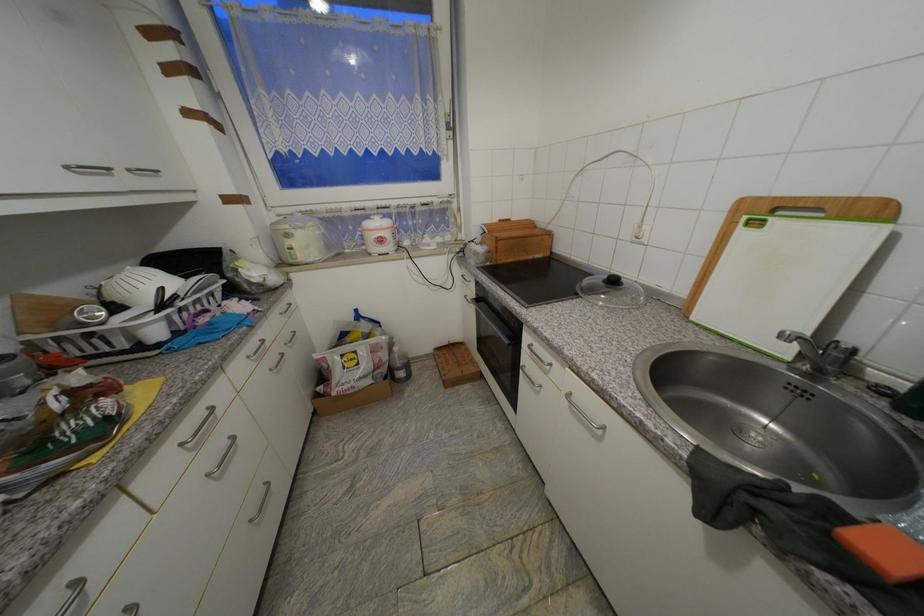
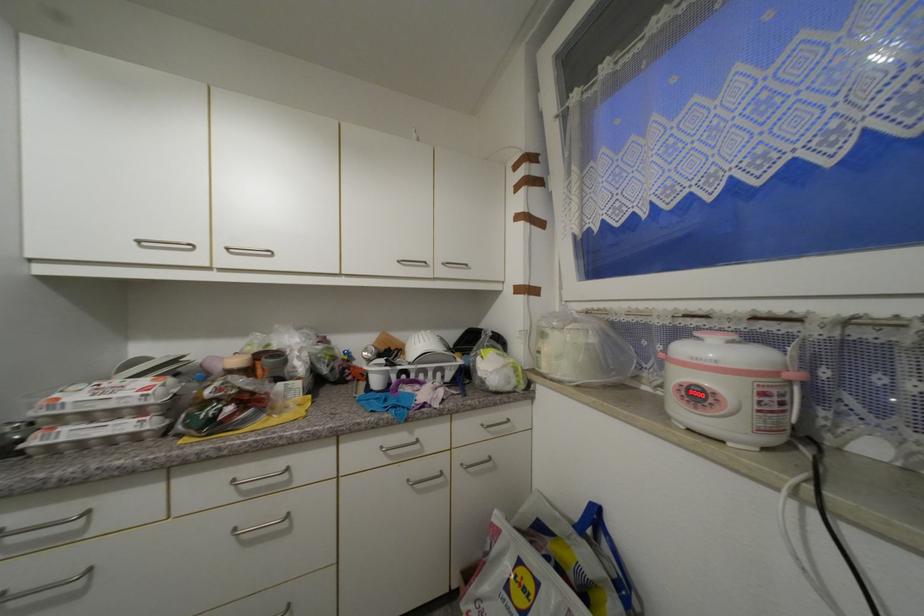
Locate, in the second image, the point that corresponds to the point at 74,169 in the first image.

(405, 262)